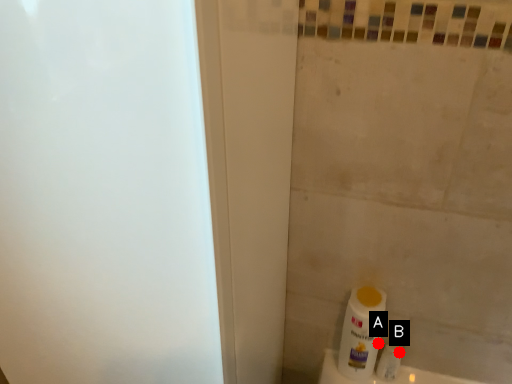
Question: Two points are circled on the image, labeled by A and B beside each circle. Among these points, which one is farthest from the camera?

Choices:
 (A) A is further
 (B) B is further

Answer: (B)